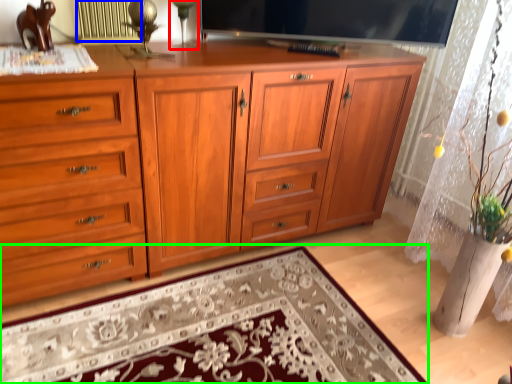
Question: Based on their relative distances, which object is nearer to table lamp (highlighted by a red box)? Choose from radiator (highlighted by a blue box) and mat (highlighted by a green box).

Choices:
 (A) radiator
 (B) mat

Answer: (A)